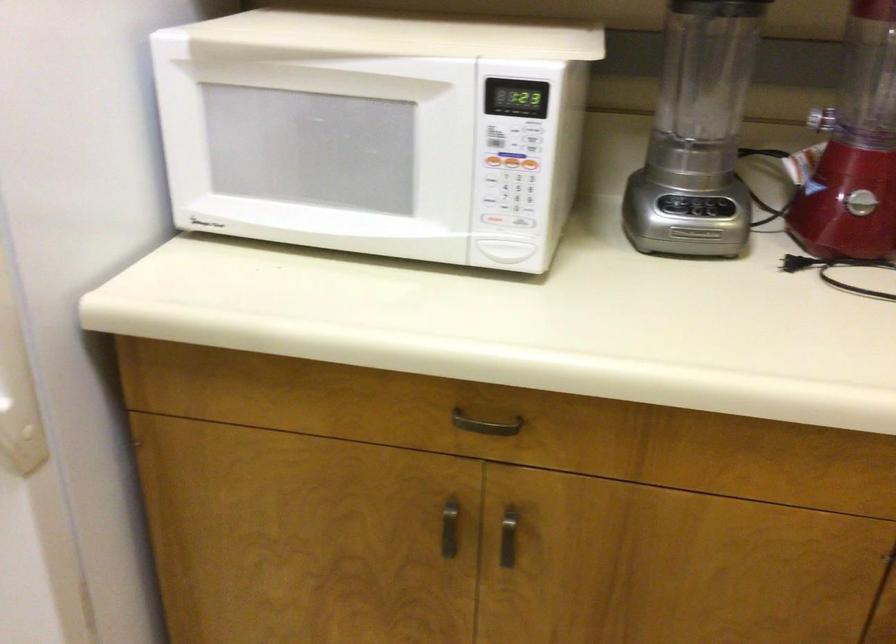
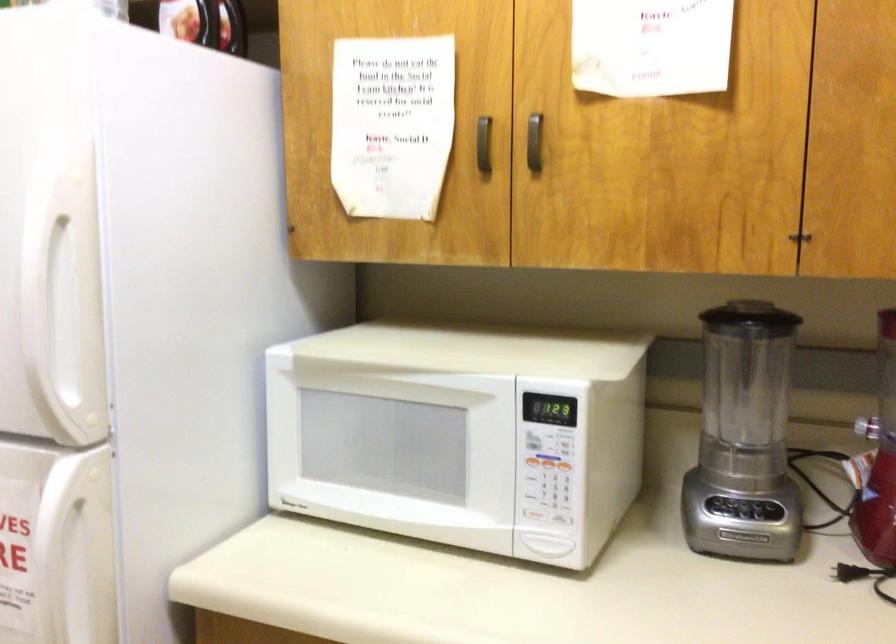
Locate, in the second image, the point that corresponds to (x=509, y=156) in the first image.

(547, 462)